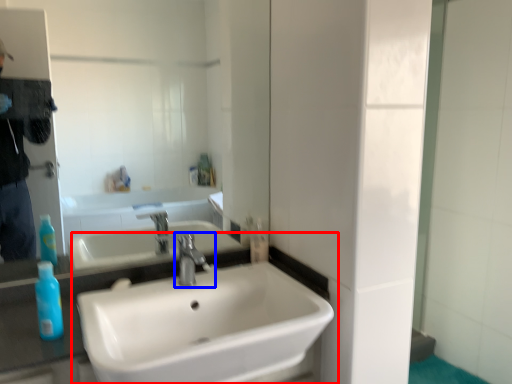
Question: Among these objects, which one is farthest to the camera, sink (highlighted by a red box) or tap (highlighted by a blue box)?

Choices:
 (A) sink
 (B) tap

Answer: (B)